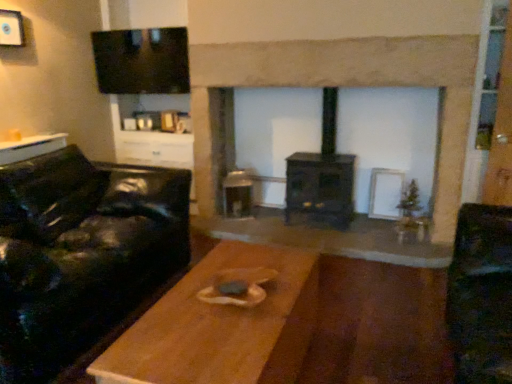
You are a GUI agent. You are given a task and a screenshot of the screen. Output one action in this format:
    pyautogui.click(x=<x>, y=<y>)
    Task: Click on the free location in front of black matte wood burning stove at center
    
    Given the screenshot: What is the action you would take?
    pyautogui.click(x=341, y=241)